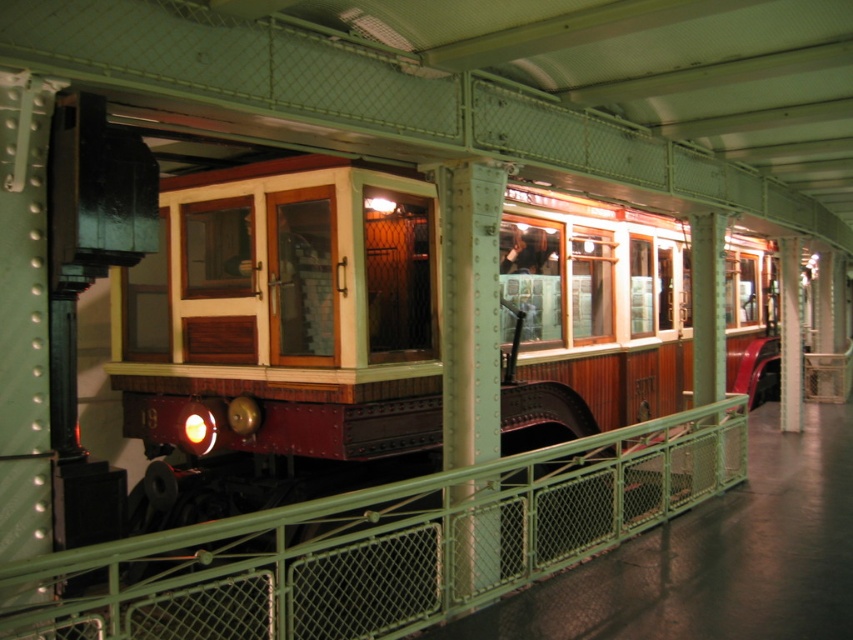
You are standing at the entrance of the museum and want to take a photo of the wooden paneling train at center. Where should you position yourself to ensure the train is in the center of your camera frame?

The wooden paneling train at center is located at point (285, 314), so you should position yourself directly in front of that coordinate to center it in your camera frame.

You are a visitor standing in the museum and want to take a photo of the wooden paneling train at center. The green metal fence at center is blocking your view. Can you easily take a photo without moving the fence?

The wooden paneling train at center has a lesser height compared to green metal fence at center, so the green metal fence at center may block the view. You might need to move the fence or adjust your position to take an unobstructed photo.

You are a maintenance worker needing to inspect both the wooden paneling train at center and the green metal fence at center. Given that your inspection tool has a 10 feet reach, can you reach both objects from your current position without moving?

The wooden paneling train at center and the green metal fence at center are 10.83 feet apart from each other. Since the tool only reaches 10 feet, you cannot reach both objects without moving.